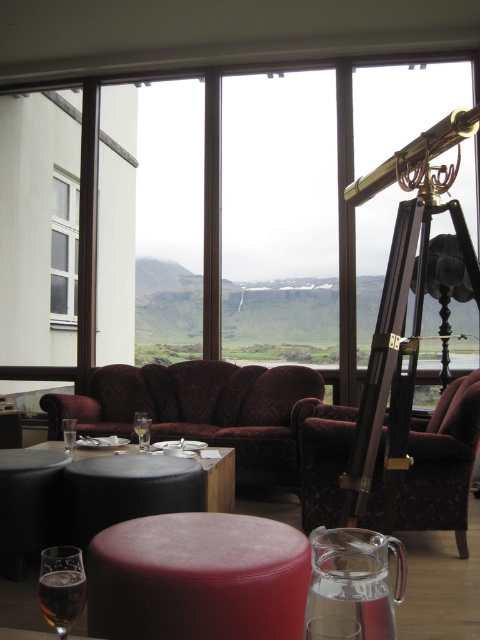
You are sitting in the velvet burgundy armchair at center and want to look out the white plastic window at upper left. Can you easily see the window from your current position?

The velvet burgundy armchair at center is closer to the viewer than the white plastic window at upper left, so you can easily see the window from your current position.

You are a guest in this room and want to place your phone on the black leather table at center without it falling off. Is the clear glass wine glass at lower left currently blocking the table?

The black leather table at center is positioned under the clear glass wine glass at lower left, so the wine glass is blocking the table. You will need to move the wine glass to access the table.

You are a guest in this room and want to pour water from the glass pitcher into the wine glass. Which object should you avoid spilling water on, the white plastic window at upper left or the amber glass at lower left?

You should avoid spilling water on the white plastic window at upper left because it is larger in size compared to the amber glass at lower left, making it a bigger target for potential spills.